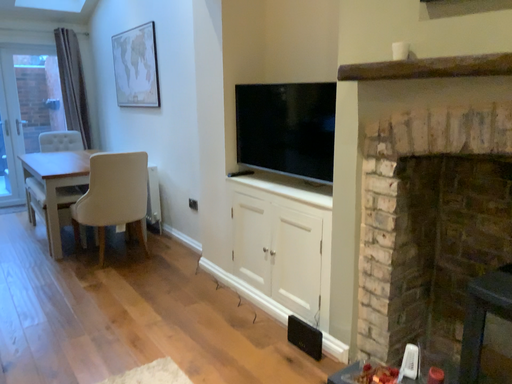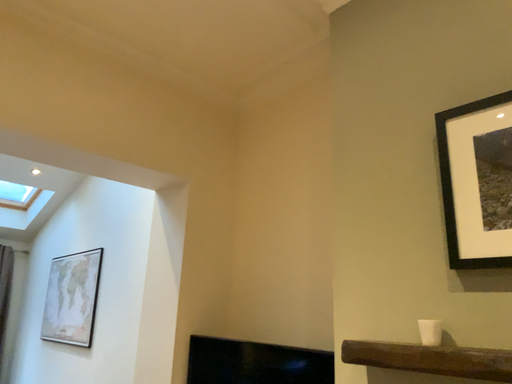
Question: Which way did the camera rotate in the video?

Choices:
 (A) rotated right
 (B) rotated left

Answer: (A)